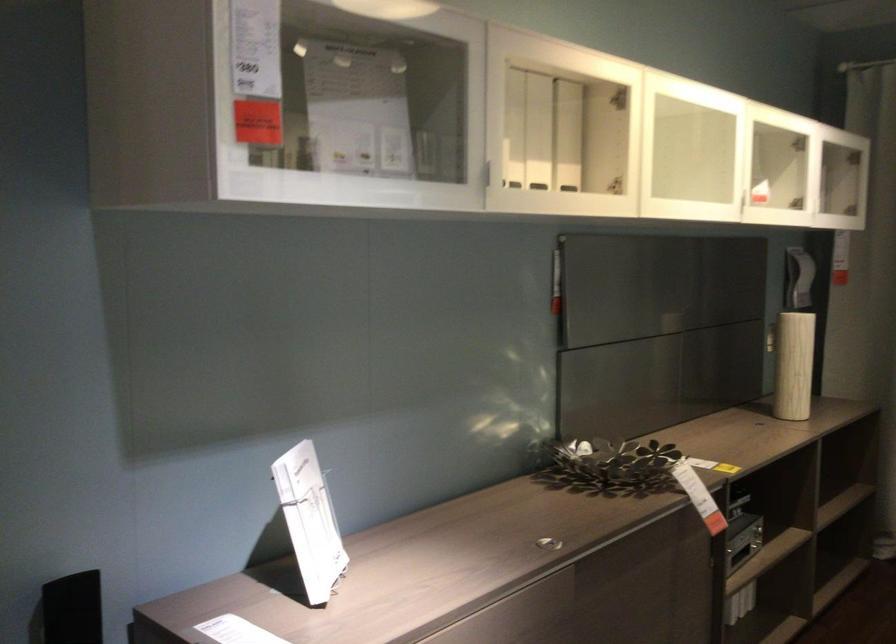
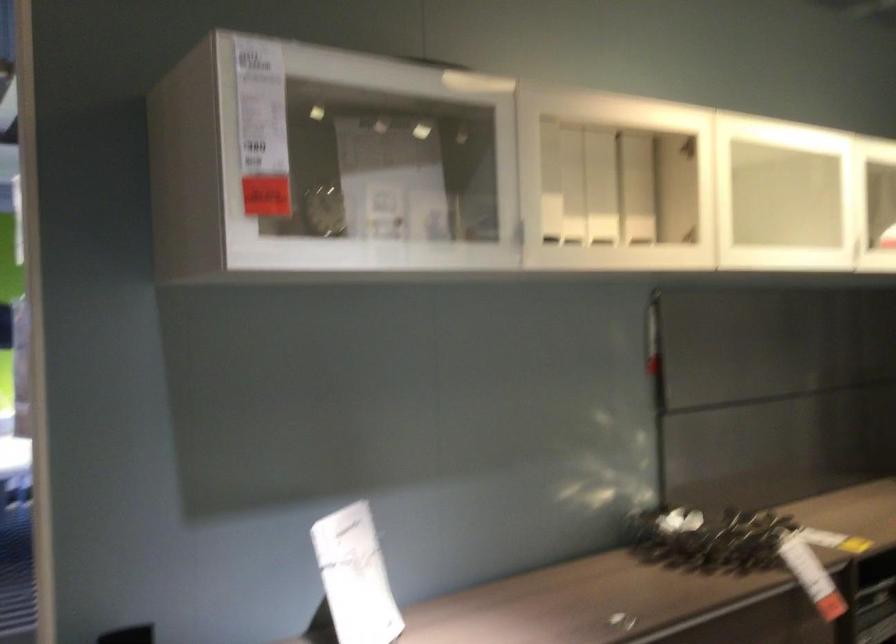
Where in the second image is the point corresponding to [495,172] from the first image?

(519, 232)